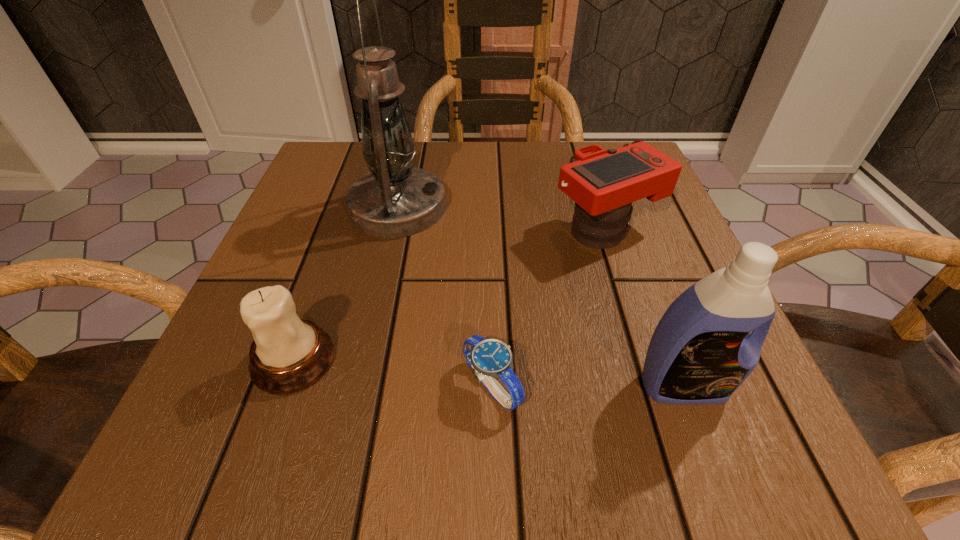
Identify the location of free point between the third object from left to right and the camera. (549, 308).

This screenshot has width=960, height=540. In order to click on vacant area that lies between the second tallest object and the tallest object in this screenshot , I will do tap(540, 296).

Find the location of a particular element. free area in between the watch and the camera is located at coordinates (549, 308).

Where is `the second closest object to the watch`? The height and width of the screenshot is (540, 960). the second closest object to the watch is located at coordinates (289, 354).

Find the location of a particular element. The height and width of the screenshot is (540, 960). object that stands as the second closest to the watch is located at coordinates (289, 354).

Identify the location of vacant area in the image that satisfies the following two spatial constraints: 1. on the back side of the third object from left to right; 2. on the left side of the camera. (489, 230).